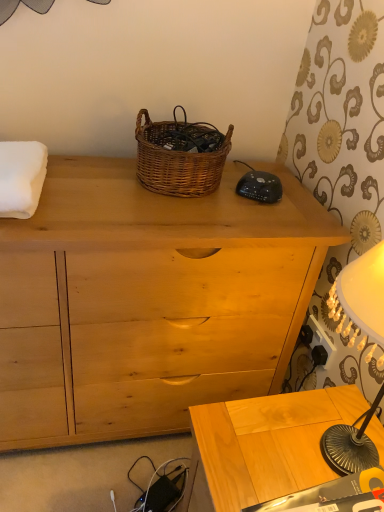
Question: From the image's perspective, is woven brown picnic basket at center located above or below light wood table at lower right?

Choices:
 (A) above
 (B) below

Answer: (A)

Question: In the image, is woven brown picnic basket at center positioned in front of or behind light wood table at lower right?

Choices:
 (A) behind
 (B) front

Answer: (A)

Question: Which object is positioned farthest from the light wood table at lower right?

Choices:
 (A) natural wood chest of drawers at center
 (B) woven brown picnic basket at center
 (C) black plastic power outlet at lower right

Answer: (B)

Question: Which is farther from the black plastic power outlet at lower right?

Choices:
 (A) light wood table at lower right
 (B) natural wood chest of drawers at center
 (C) woven brown picnic basket at center

Answer: (C)